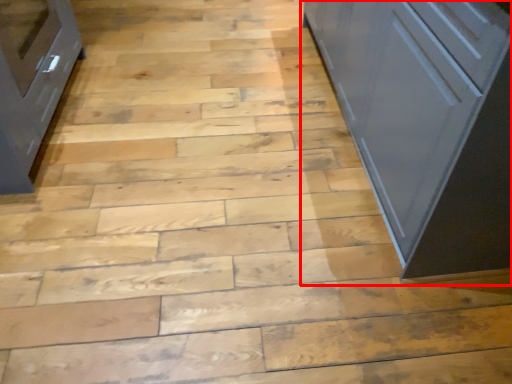
Question: Where is cupboard (annotated by the red box) located in relation to cabinetry in the image?

Choices:
 (A) right
 (B) left

Answer: (A)